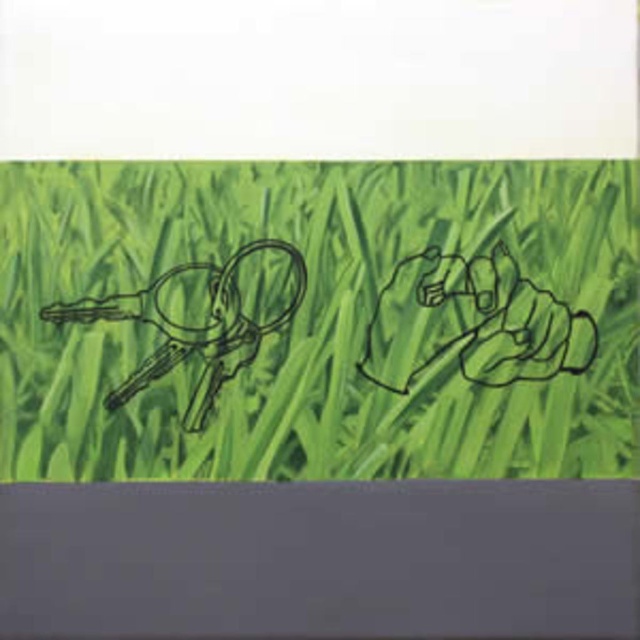
You are an artist trying to draw the scene. You want to ensure the green grass at center and metallic keys at left are proportionally accurate. Which object should you draw wider?

The green grass at center should be drawn wider than the metallic keys at left since its width surpasses the keys.

You are an artist trying to draw the scene described. If you want to make the metallic keys at left stand out more against the green grass at center, what could you do based on their sizes?

Since the green grass at center is much taller than the metallic keys at left, you could shorten the grass or enlarge the keys to create a better contrast in size, making the metallic keys at left more prominent.